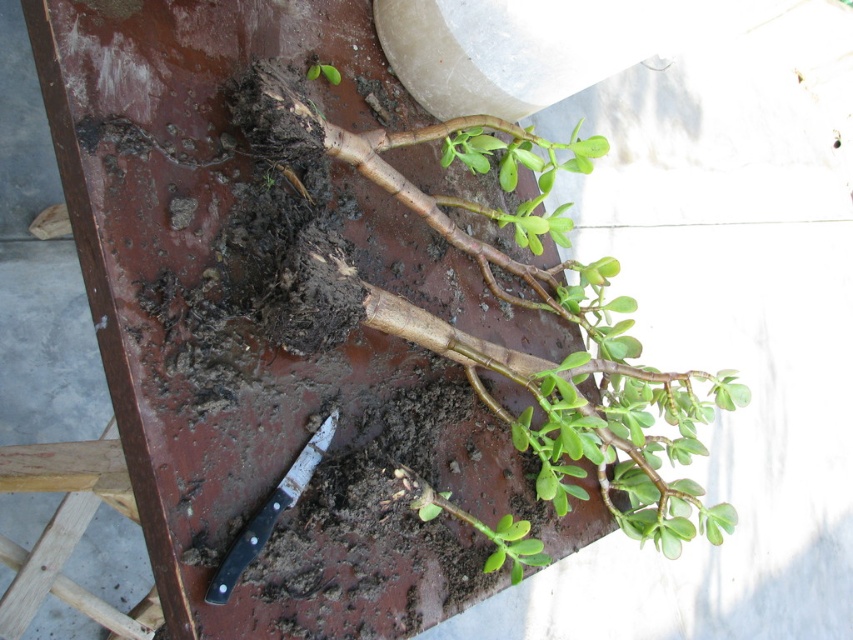
What is located at the coordinates point (x=521, y=307) in the image?

The green matte plant at center is located at point (x=521, y=307).

You are a gardener working on repotting a succulent. You need to place the plant into a new pot. Where is the dull brown soil at center in relation to the white object at top right?

The dull brown soil at center is located at point (241, 323), which is below the white object at top right.